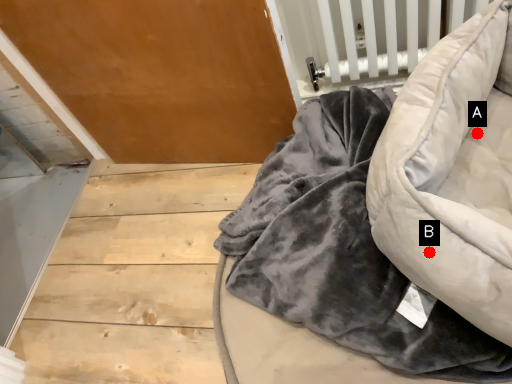
Question: Two points are circled on the image, labeled by A and B beside each circle. Which of the following is the farthest from the observer?

Choices:
 (A) A is further
 (B) B is further

Answer: (A)